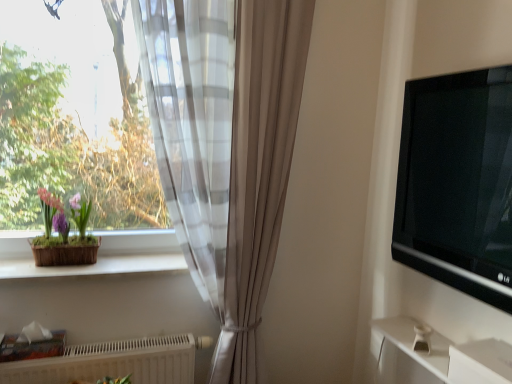
Image resolution: width=512 pixels, height=384 pixels. I want to click on blank space situated above white smooth window sill at lower left (from a real-world perspective), so click(x=97, y=263).